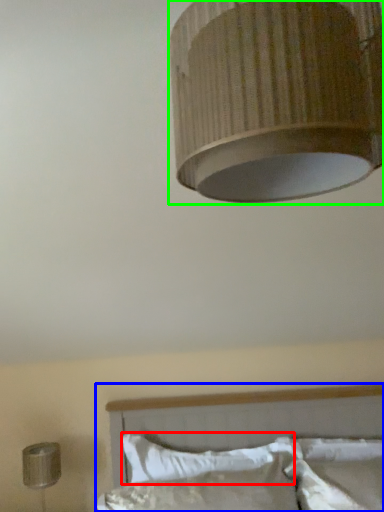
Question: Considering the real-world distances, which object is closest to pillow (highlighted by a red box)? bed (highlighted by a blue box) or lamp (highlighted by a green box).

Choices:
 (A) bed
 (B) lamp

Answer: (A)